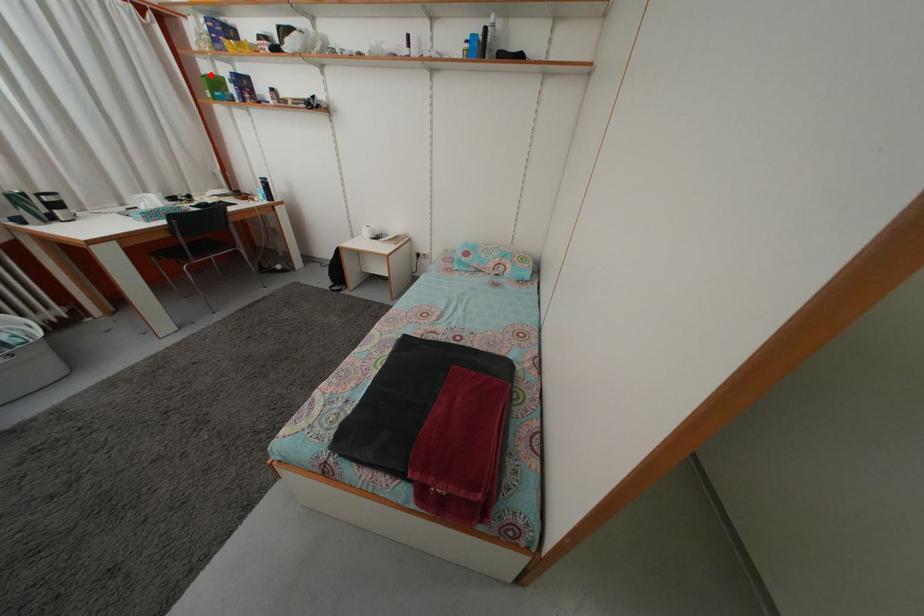
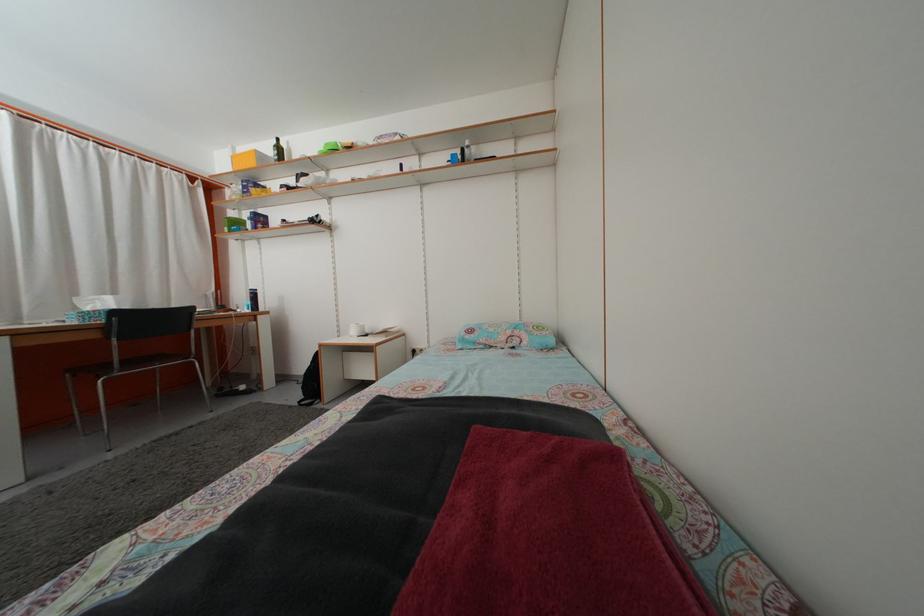
Where in the second image is the point corresponding to the highlighted location from the first image?

(237, 223)